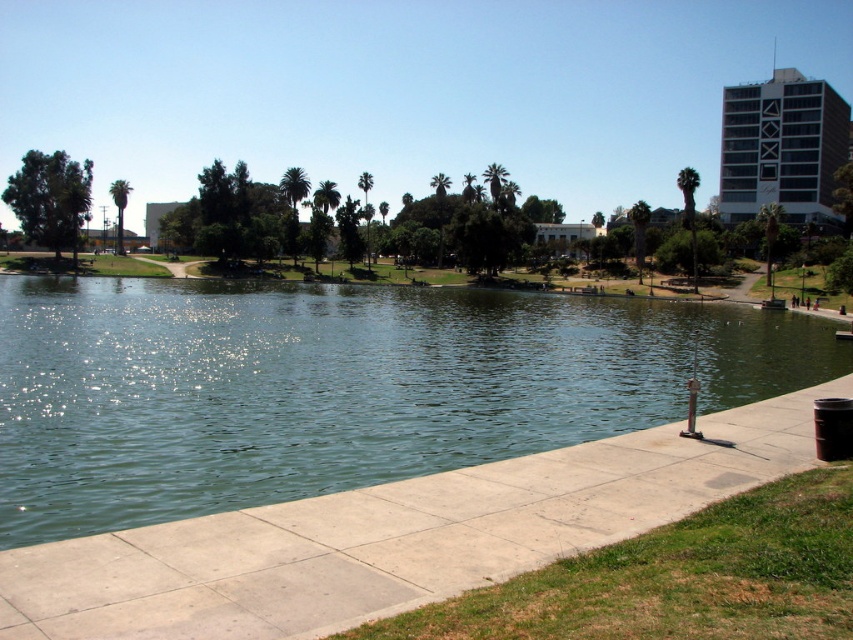
Question: Is green concrete lake at center positioned at the back of smooth concrete pavement at lower center?

Choices:
 (A) no
 (B) yes

Answer: (B)

Question: Which object appears closest to the camera in this image?

Choices:
 (A) green concrete lake at center
 (B) smooth concrete pavement at lower center

Answer: (B)

Question: Among these points, which one is farthest from the camera?

Choices:
 (A) (78, 500)
 (B) (190, 612)

Answer: (A)

Question: Can you confirm if green concrete lake at center is positioned above smooth concrete pavement at lower center?

Choices:
 (A) yes
 (B) no

Answer: (A)

Question: Can you confirm if green concrete lake at center is positioned to the right of smooth concrete pavement at lower center?

Choices:
 (A) yes
 (B) no

Answer: (B)